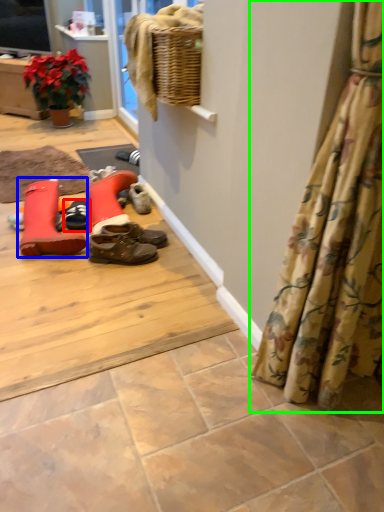
Question: Which object is the closest to the footwear (highlighted by a red box)? Choose among these: footwear (highlighted by a blue box) or curtain (highlighted by a green box).

Choices:
 (A) footwear
 (B) curtain

Answer: (A)